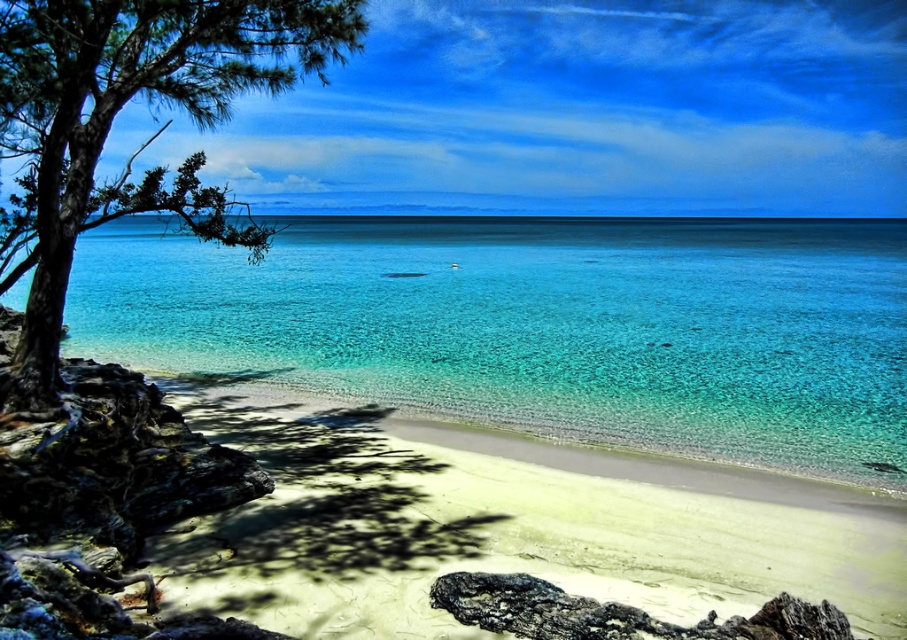
Can you confirm if clear blue water at center is thinner than green matte tree at left?

Incorrect, clear blue water at center's width is not less than green matte tree at left's.

Which of these two, clear blue water at center or green matte tree at left, stands taller?

clear blue water at center

Who is more forward, (628, 417) or (201, 12)?

Positioned in front is point (201, 12).

In order to click on clear blue water at center in this screenshot , I will do 542,326.